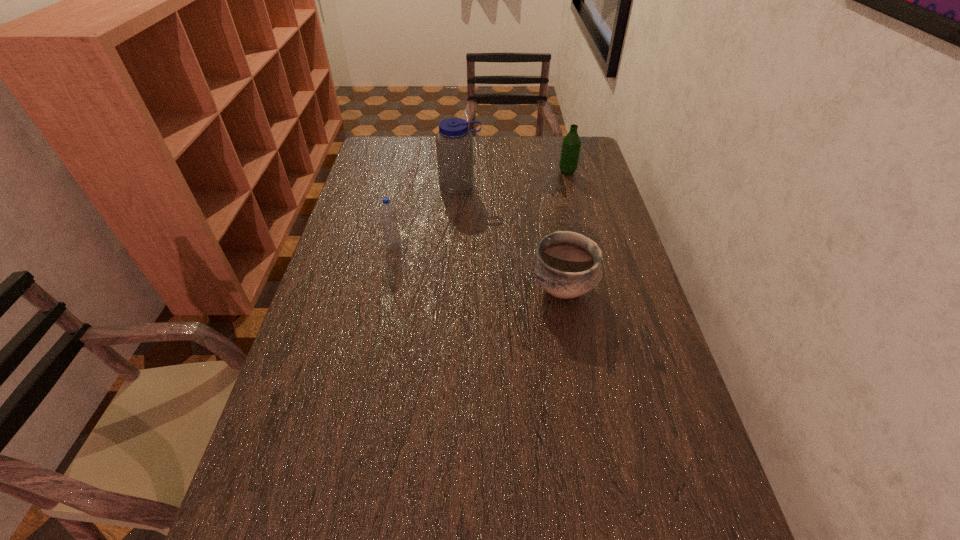
You are a GUI agent. You are given a task and a screenshot of the screen. Output one action in this format:
    pyautogui.click(x=<x>, y=<y>)
    Task: Click on the third object from right to left
    Image resolution: width=960 pixels, height=540 pixels.
    Given the screenshot: What is the action you would take?
    pyautogui.click(x=454, y=143)

What are the coordinates of `the second water bottle from left to right` in the screenshot? It's located at (454, 143).

Where is `the rightmost water bottle`? the rightmost water bottle is located at coordinates (570, 150).

The height and width of the screenshot is (540, 960). Find the location of `the leftmost water bottle`. the leftmost water bottle is located at coordinates (388, 215).

The image size is (960, 540). I want to click on the leftmost object, so click(388, 215).

This screenshot has width=960, height=540. In order to click on the nearest object in this screenshot , I will do `click(566, 264)`.

Identify the location of pottery. This screenshot has height=540, width=960. (566, 264).

I want to click on vacant space situated with a carrying loop on the side of the third object from right to left, so click(x=458, y=220).

Where is `free location located 0.090m on the back of the rightmost water bottle`? This screenshot has height=540, width=960. free location located 0.090m on the back of the rightmost water bottle is located at coordinates (563, 155).

Locate an element on the screen. This screenshot has width=960, height=540. vacant position located 0.210m on the back of the leftmost object is located at coordinates (403, 201).